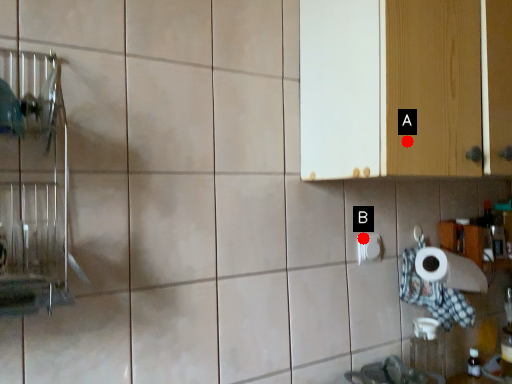
Question: Two points are circled on the image, labeled by A and B beside each circle. Which of the following is the closest to the observer?

Choices:
 (A) A is closer
 (B) B is closer

Answer: (A)